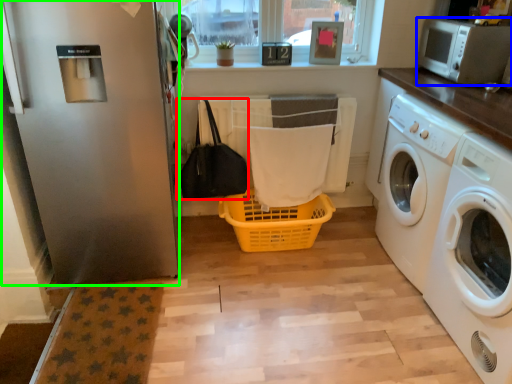
Question: Which object is positioned closest to bag (highlighted by a red box)? Select from microwave oven (highlighted by a blue box) and screen door (highlighted by a green box).

Choices:
 (A) microwave oven
 (B) screen door

Answer: (B)